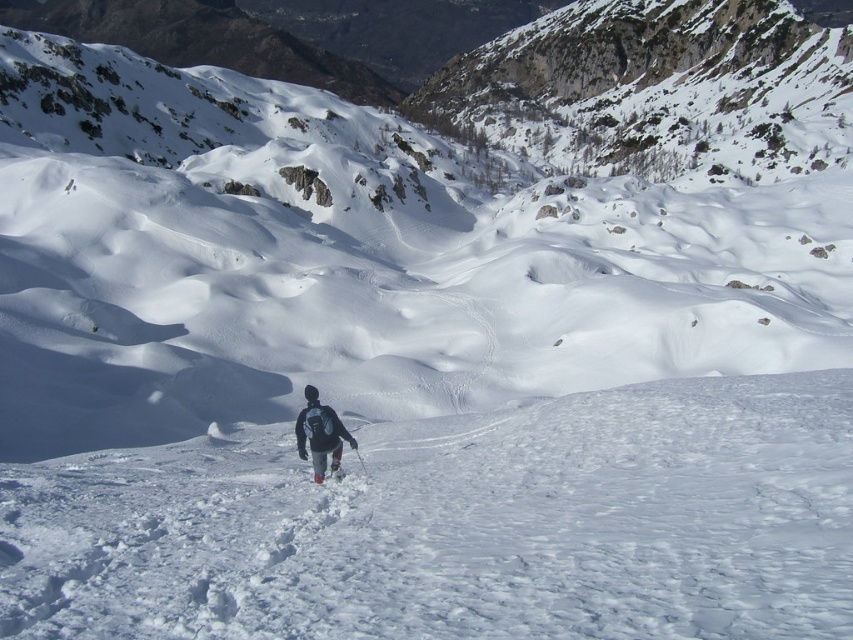
You are a hiker who has just stopped to take a break on the snowy slope. You notice your gray fabric backpack at center and your white matte ski at center. Which item is positioned to the left of the other?

The gray fabric backpack at center is to the left of the white matte ski at center.

You are navigating a snowy slope and need to locate your gray fabric backpack at center. According to the map coordinates provided, where would you find it?

The gray fabric backpack at center is located at coordinates point (320,435).

Consider the image. You are a hiker carrying a gray fabric backpack at center and a white matte ski at center. You need to place them both on the ground so that they are exactly 2 meters apart. Can you do it?

The distance between the gray fabric backpack at center and the white matte ski at center is currently 1.99 meters. Since you need them to be exactly 2 meters apart, you can move them slightly further apart to achieve the desired distance.